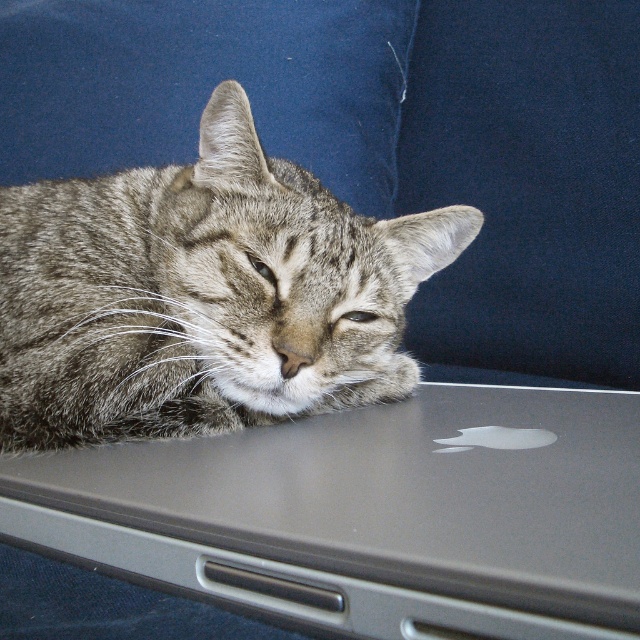
Is satin silver laptop at upper center closer to the viewer compared to gray tabby cat at center?

Yes, satin silver laptop at upper center is in front of gray tabby cat at center.

Who is more distant from viewer, (70,529) or (208,243)?

The point (208,243) is more distant.

Identify the location of satin silver laptop at upper center. (374, 512).